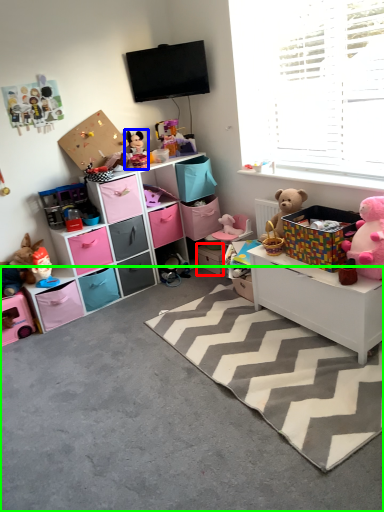
Question: Which object is positioned closest to storage box (highlighted by a red box)? Select from toy (highlighted by a blue box) and concrete (highlighted by a green box).

Choices:
 (A) toy
 (B) concrete

Answer: (A)